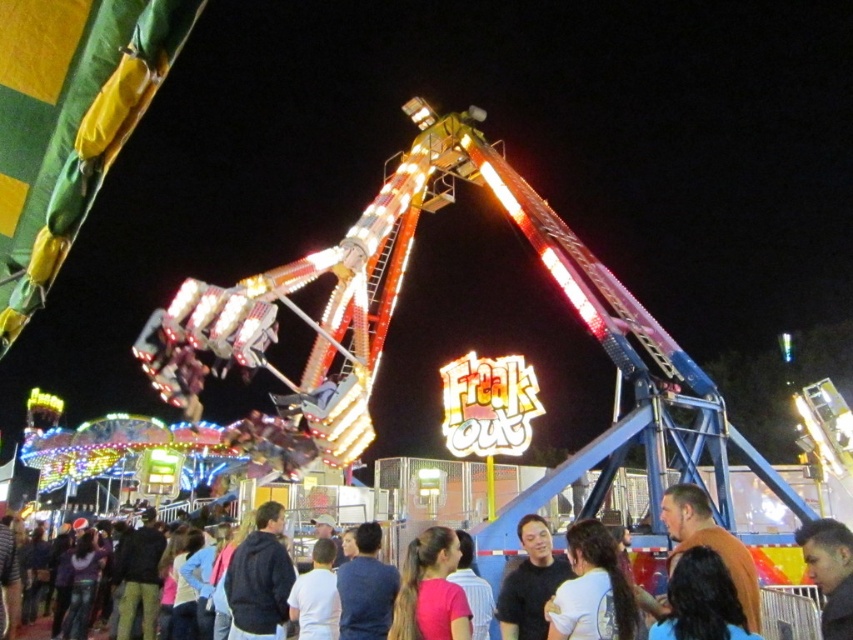
You are standing at the entrance of the amusement park and see the pink matte shirt at center and the blue fabric shirt at lower center. Which person is positioned to the right of the other?

The pink matte shirt at center is to the right of the blue fabric shirt at lower center.

You are an amusement park attendant checking the crowd for safety. You notice two people in the crowd wearing a black matte jacket at lower left and a dark brown shirt at center. Which clothing item is bigger in size?

The black matte jacket at lower left has a larger size compared to the dark brown shirt at center.